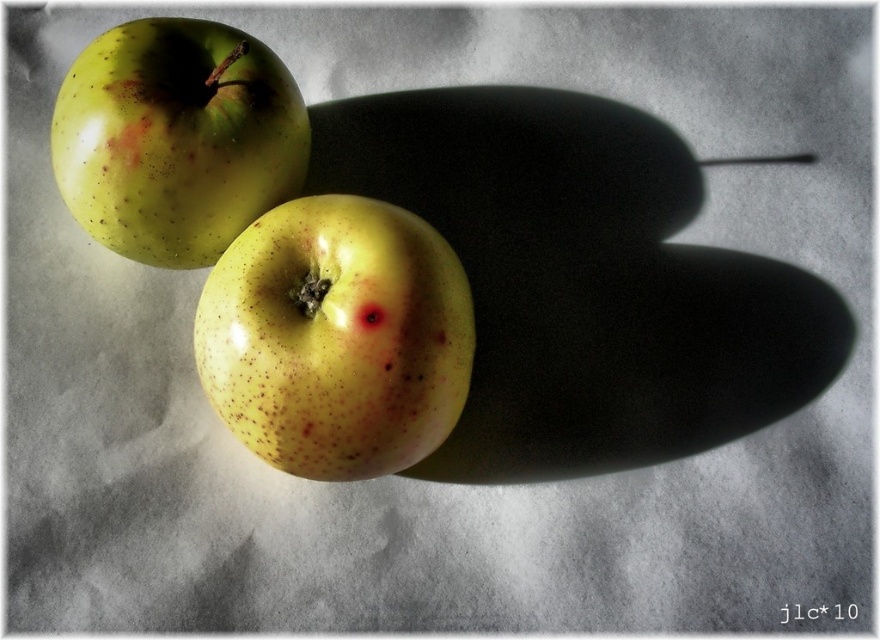
You are an apple vendor arranging apples on a shelf. You have a yellow speckled apple at center and a green speckled apple at upper left. Which apple takes up more space on the shelf?

The green speckled apple at upper left takes up more space on the shelf because it occupies more space than the yellow speckled apple at center according to the description.

You are an apple picker trying to determine if there is an apple at a specific coordinate. Based on the scene description, is there an apple located at point [336,337]?

Yes, there is a yellow speckled apple at center located at point [336,337].